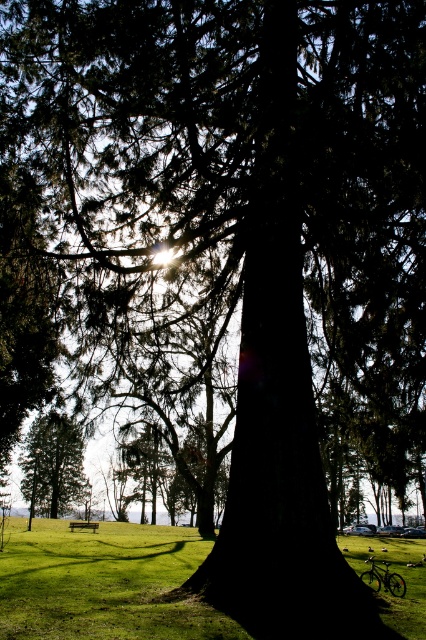
You are standing in the park and want to sit down. You see the green grass at center and the wooden bench at lower center. Which one is closer to you?

The green grass at center is closer to the viewer than the wooden bench at lower center, so the green grass at center is closer.

You are standing in the park and want to place a small garden gnome between the two points, point [42,448] and point [86,528]. Since the gnome is 0.1 meters tall, will it be visible from your current position?

Point [42,448] is closer to you than point [86,528]. Since the gnome is 0.1 meters tall, it will be visible from your current position as it is placed between the two points, with the closer point being higher in the foreground.